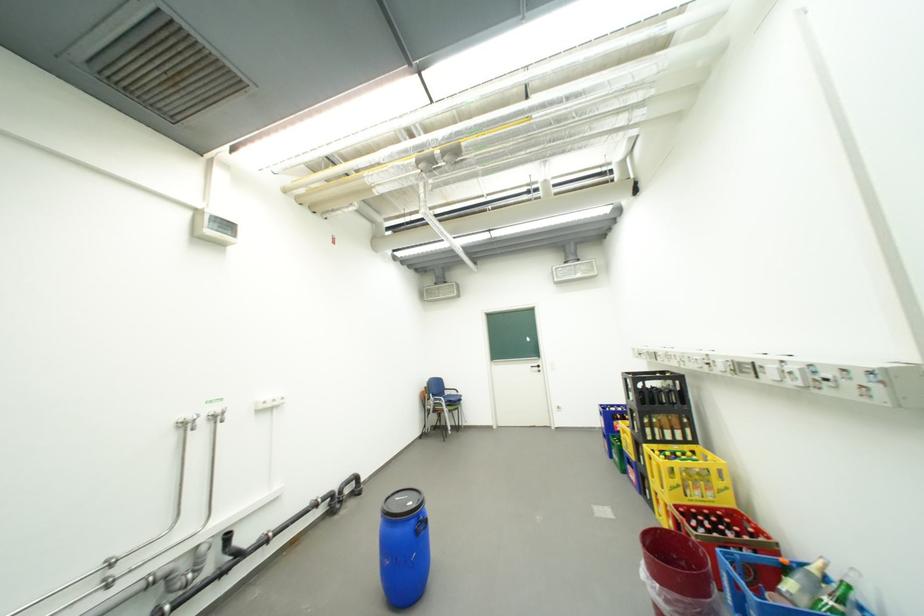
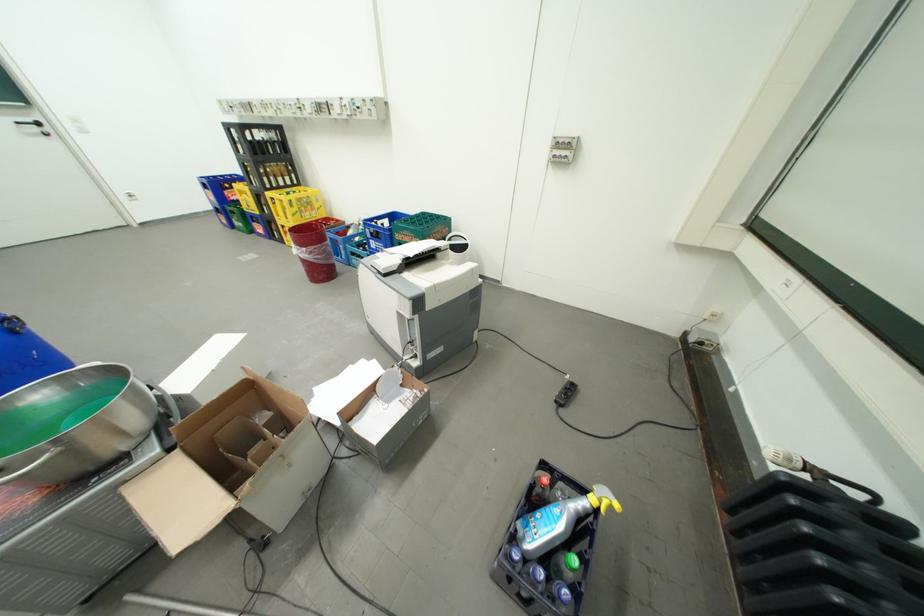
The point at (565, 410) is marked in the first image. Where is the corresponding point in the second image?

(134, 199)